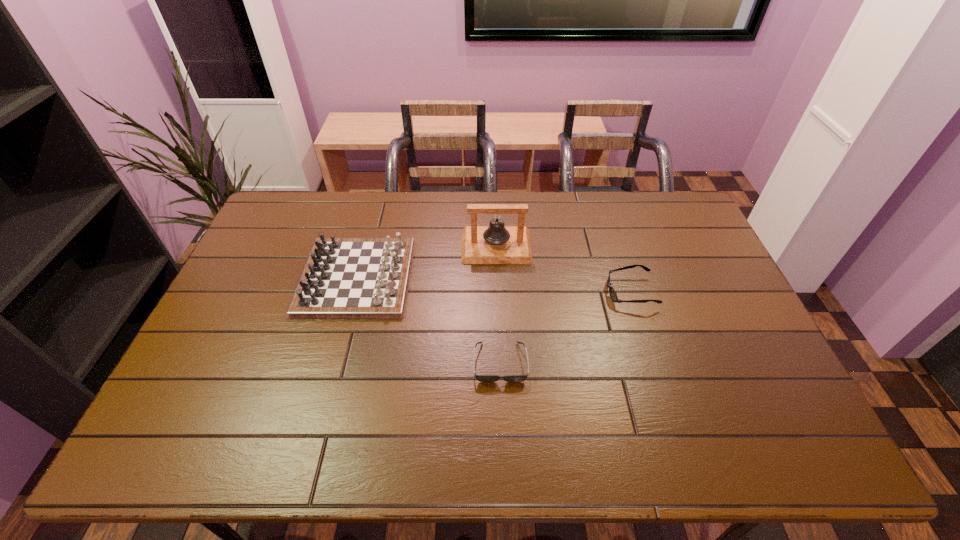
At what (x,y) coordinates should I click in order to perform the action: click on vacant space that's between the nearer sunglasses and the right sunglasses. Please return your answer as a coordinate pair (x, y). Looking at the image, I should click on (565, 327).

Locate an element on the screen. This screenshot has height=540, width=960. vacant point located between the right sunglasses and the tallest object is located at coordinates (564, 269).

Where is `free spot between the third tallest object and the tallest object`? The width and height of the screenshot is (960, 540). free spot between the third tallest object and the tallest object is located at coordinates (564, 269).

You are a GUI agent. You are given a task and a screenshot of the screen. Output one action in this format:
    pyautogui.click(x=<x>, y=<y>)
    Task: Click on the empty space that is in between the shortest object and the tallest object
    This screenshot has width=960, height=540.
    Given the screenshot: What is the action you would take?
    pyautogui.click(x=498, y=304)

You are a GUI agent. You are given a task and a screenshot of the screen. Output one action in this format:
    pyautogui.click(x=<x>, y=<y>)
    Task: Click on the vacant area that lies between the third shortest object and the tallest object
    This screenshot has width=960, height=540.
    Given the screenshot: What is the action you would take?
    pyautogui.click(x=426, y=261)

Where is `blank region between the bell and the leftmost object`? The height and width of the screenshot is (540, 960). blank region between the bell and the leftmost object is located at coordinates (426, 261).

Find the location of a particular element. free spot between the tallest object and the leftmost object is located at coordinates (426, 261).

At what (x,y) coordinates should I click in order to perform the action: click on free spot between the farther sunglasses and the bell. Please return your answer as a coordinate pair (x, y). Looking at the image, I should click on (564, 269).

Find the location of a particular element. Image resolution: width=960 pixels, height=540 pixels. object that is the second closest to the taller sunglasses is located at coordinates (482, 378).

What are the coordinates of `object that is the second nearest to the tallest object` in the screenshot? It's located at (612, 292).